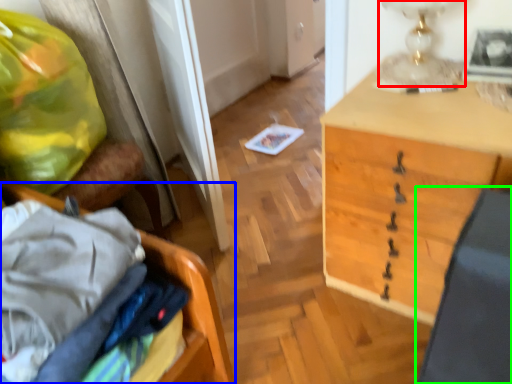
Question: Which is farther away from table lamp (highlighted by a red box)? furniture (highlighted by a blue box) or swivel chair (highlighted by a green box)?

Choices:
 (A) furniture
 (B) swivel chair

Answer: (A)